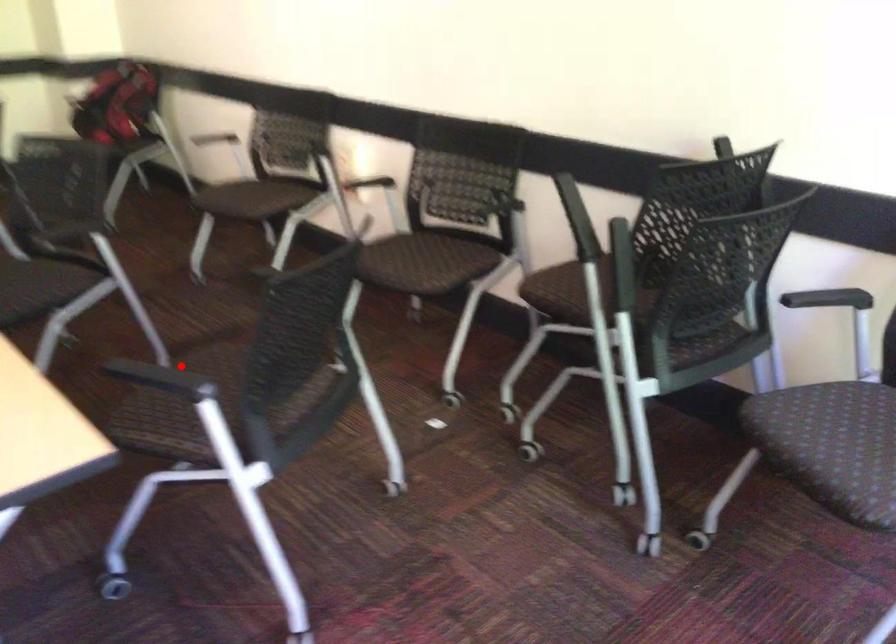
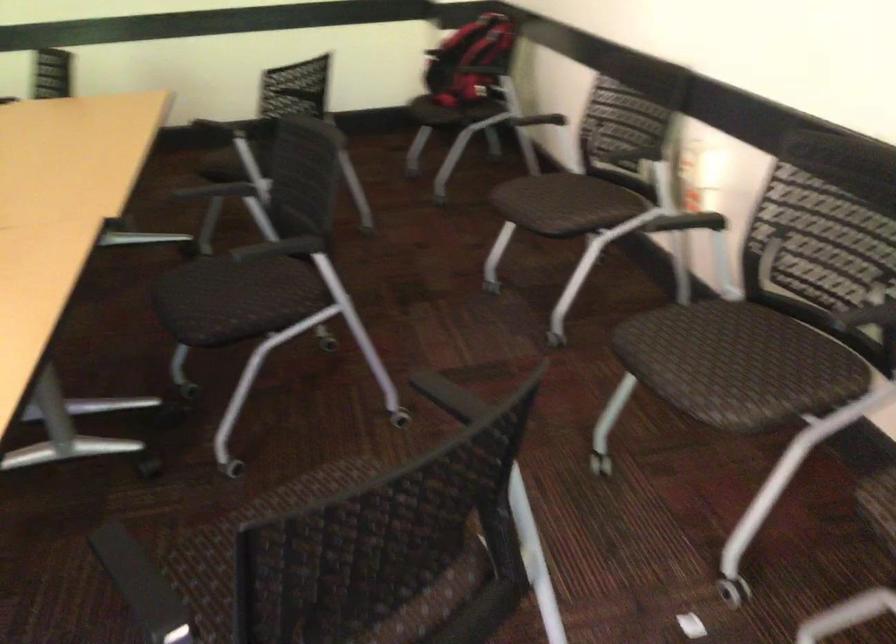
Question: I am providing you with two images of the same scene from different viewpoints. A red point is shown in image1. For the corresponding object point in image2, is it positioned nearer or farther from the camera?

Choices:
 (A) Nearer
 (B) Farther

Answer: (A)